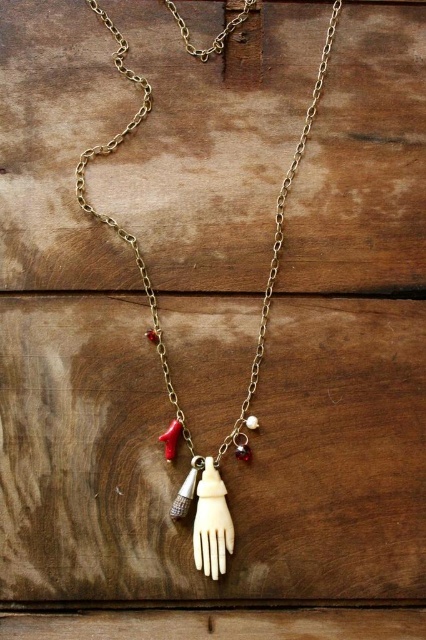
Who is lower down, matte silver charm at center or pearl-like bone hand at center?

Positioned lower is matte silver charm at center.

Identify the location of matte silver charm at center. The width and height of the screenshot is (426, 640). (187, 490).

Who is more distant from viewer, (184, 484) or (233, 438)?

The point (233, 438) is more distant.

Locate an element on the screen. The image size is (426, 640). matte silver charm at center is located at coordinates (187, 490).

Can you confirm if bone/carved hand at center is shorter than matte silver charm at center?

No, bone/carved hand at center is not shorter than matte silver charm at center.

Between point (201, 525) and point (196, 472), which one is positioned in front?

Point (201, 525) is more forward.

Where is `bone/carved hand at center`? This screenshot has width=426, height=640. bone/carved hand at center is located at coordinates (250, 372).

The width and height of the screenshot is (426, 640). Find the location of `bone/carved hand at center`. bone/carved hand at center is located at coordinates (250, 372).

Is bone/carved hand at center closer to the viewer compared to pearl-like bone hand at center?

Yes, it is.

Between point (233, 426) and point (241, 436), which one is positioned in front?

Point (241, 436)

Where is `bone/carved hand at center`? The image size is (426, 640). bone/carved hand at center is located at coordinates [x=250, y=372].